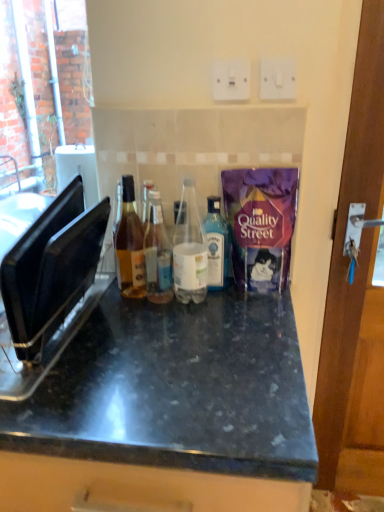
Question: From the image's perspective, is white plastic electric outlet at upper center, the 1th electric outlet positioned from the left, located above translucent glass bottle at center, the second bottle in the left-to-right sequence?

Choices:
 (A) no
 (B) yes

Answer: (B)

Question: Is translucent glass bottle at center, the second bottle in the left-to-right sequence, inside white plastic electric outlet at upper center, the 1th electric outlet positioned from the left?

Choices:
 (A) no
 (B) yes

Answer: (A)

Question: Is white plastic electric outlet at upper center, acting as the 2th electric outlet starting from the right, taller than translucent glass bottle at center, which is counted as the 3th bottle, starting from the right?

Choices:
 (A) no
 (B) yes

Answer: (A)

Question: From a real-world perspective, is white plastic electric outlet at upper center, acting as the 2th electric outlet starting from the right, physically above translucent glass bottle at center, the second bottle in the left-to-right sequence?

Choices:
 (A) yes
 (B) no

Answer: (A)

Question: Is white plastic electric outlet at upper center, acting as the 2th electric outlet starting from the right, to the right of translucent glass bottle at center, which is counted as the 3th bottle, starting from the right, from the viewer's perspective?

Choices:
 (A) no
 (B) yes

Answer: (B)

Question: Does white plastic electric outlet at upper center, acting as the 2th electric outlet starting from the right, lie in front of translucent glass bottle at center, which is counted as the 3th bottle, starting from the right?

Choices:
 (A) no
 (B) yes

Answer: (A)

Question: Considering the relative sizes of white plastic electric outlet at upper center, acting as the 2th electric outlet starting from the right, and amber glass bottle at center, the 1th bottle in the left-to-right sequence, in the image provided, is white plastic electric outlet at upper center, acting as the 2th electric outlet starting from the right, smaller than amber glass bottle at center, the 1th bottle in the left-to-right sequence,?

Choices:
 (A) yes
 (B) no

Answer: (A)

Question: Is white plastic electric outlet at upper center, the 1th electric outlet positioned from the left, with amber glass bottle at center, which is counted as the 4th bottle, starting from the right?

Choices:
 (A) yes
 (B) no

Answer: (B)

Question: Is white plastic electric outlet at upper center, acting as the 2th electric outlet starting from the right, positioned far away from amber glass bottle at center, the 1th bottle in the left-to-right sequence?

Choices:
 (A) yes
 (B) no

Answer: (B)

Question: Is white plastic electric outlet at upper center, acting as the 2th electric outlet starting from the right, facing away from amber glass bottle at center, which is counted as the 4th bottle, starting from the right?

Choices:
 (A) yes
 (B) no

Answer: (B)

Question: From the image's perspective, is white plastic electric outlet at upper center, acting as the 2th electric outlet starting from the right, on amber glass bottle at center, the 1th bottle in the left-to-right sequence?

Choices:
 (A) yes
 (B) no

Answer: (A)

Question: From a real-world perspective, is white plastic electric outlet at upper center, acting as the 2th electric outlet starting from the right, located beneath amber glass bottle at center, which is counted as the 4th bottle, starting from the right?

Choices:
 (A) no
 (B) yes

Answer: (A)

Question: Can you confirm if black plastic toaster at left is shorter than white plastic electric outlet at upper center, acting as the 2th electric outlet starting from the right?

Choices:
 (A) yes
 (B) no

Answer: (B)